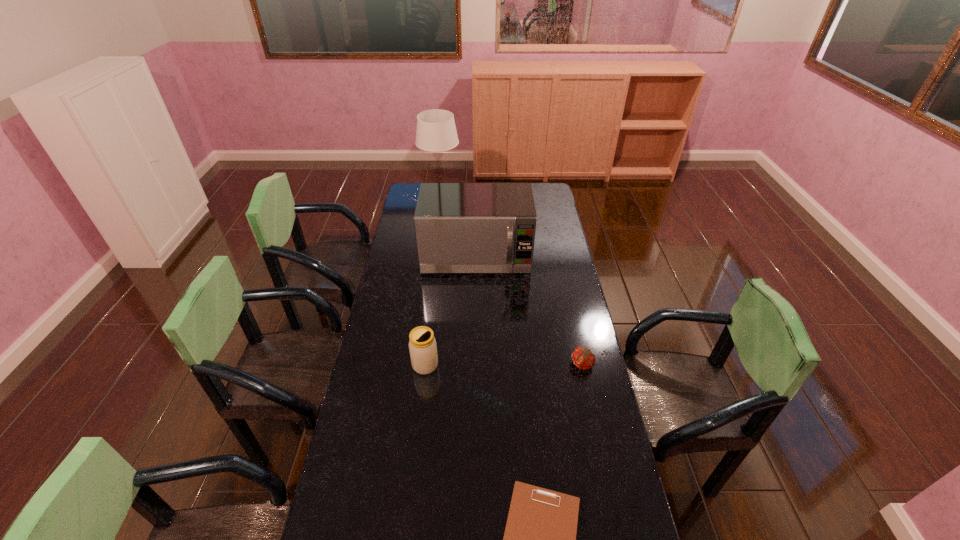
Find the location of a particular element. unoccupied position between the tomato and the second farthest object is located at coordinates (529, 310).

At what (x,y) coordinates should I click in order to perform the action: click on unoccupied area between the fourth shortest object and the second shortest object. Please return your answer as a coordinate pair (x, y). The image size is (960, 540). Looking at the image, I should click on (529, 310).

I want to click on vacant space that is in between the second shortest object and the farthest object, so click(512, 281).

Where is `vacant space in between the rightmost object and the jar`? vacant space in between the rightmost object and the jar is located at coordinates (504, 364).

Find the location of a particular element. This screenshot has width=960, height=540. object that ranks as the second closest to the jar is located at coordinates (460, 227).

Point out which object is positioned as the nearest to the microwave oven. Please provide its 2D coordinates. Your answer should be formatted as a tuple, i.e. [(x, y)], where the tuple contains the x and y coordinates of a point satisfying the conditions above.

[(436, 131)]

Locate an element on the screen. The image size is (960, 540). vacant region that satisfies the following two spatial constraints: 1. on the front-facing side of the second shortest object; 2. on the right side of the tallest object is located at coordinates click(x=420, y=364).

Find the location of a particular element. This screenshot has height=540, width=960. free space that satisfies the following two spatial constraints: 1. on the back side of the third tallest object; 2. on the front-facing side of the table lamp is located at coordinates (444, 198).

Where is `free location that satisfies the following two spatial constraints: 1. with the door open on the fourth tallest object; 2. on the left side of the second tallest object`? This screenshot has height=540, width=960. free location that satisfies the following two spatial constraints: 1. with the door open on the fourth tallest object; 2. on the left side of the second tallest object is located at coordinates (475, 364).

Locate an element on the screen. free space that satisfies the following two spatial constraints: 1. on the back side of the rightmost object; 2. on the left side of the jar is located at coordinates (425, 364).